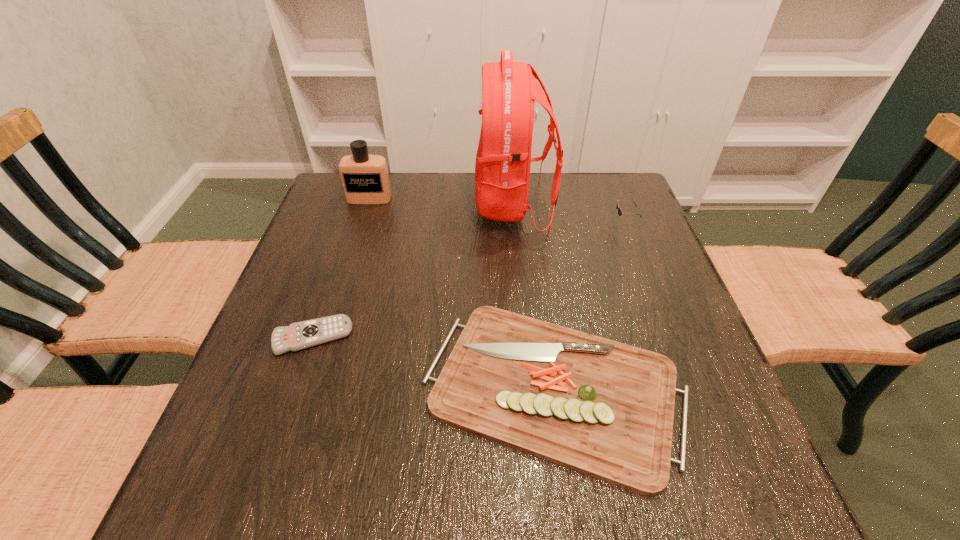
Identify the location of sunglasses that is at the right edge. (620, 212).

Find the location of a particular element. The height and width of the screenshot is (540, 960). chopping board that is at the right edge is located at coordinates (600, 407).

Where is `object located in the far left corner section of the desktop`? This screenshot has width=960, height=540. object located in the far left corner section of the desktop is located at coordinates (365, 180).

Locate an element on the screen. The height and width of the screenshot is (540, 960). object that is at the far right corner is located at coordinates (620, 212).

This screenshot has height=540, width=960. I want to click on object located at the near right corner, so click(x=600, y=407).

Locate an element on the screen. This screenshot has width=960, height=540. vacant space at the far edge of the desktop is located at coordinates (536, 190).

Locate an element on the screen. The image size is (960, 540). vacant point at the near edge is located at coordinates (425, 474).

Where is `free region at the left edge of the desktop`? This screenshot has height=540, width=960. free region at the left edge of the desktop is located at coordinates (308, 303).

In the image, there is a desktop. Identify the location of free region at the right edge. (613, 312).

This screenshot has height=540, width=960. I want to click on vacant space at the far right corner of the desktop, so click(x=600, y=186).